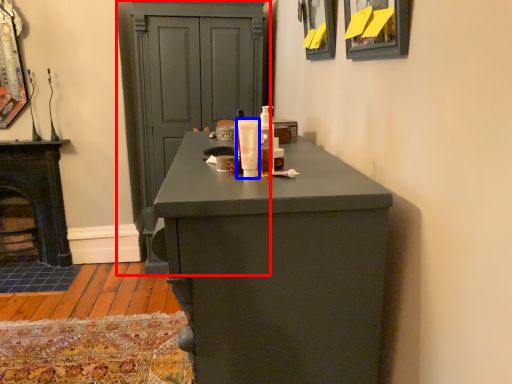
Question: Which object is further to the camera taking this photo, cupboard (highlighted by a red box) or mouthwash (highlighted by a blue box)?

Choices:
 (A) cupboard
 (B) mouthwash

Answer: (A)